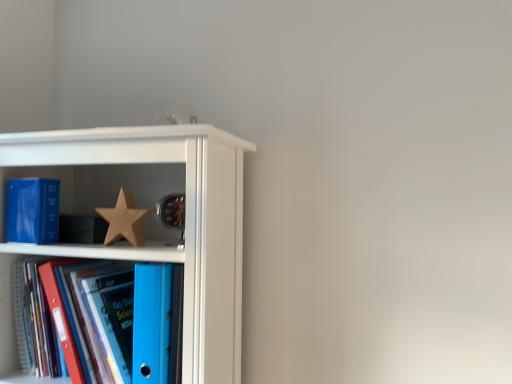
Question: Is white glossy bookshelf at upper left closer to camera compared to matte blue paperback book at left?

Choices:
 (A) yes
 (B) no

Answer: (A)

Question: From a real-world perspective, is white glossy bookshelf at upper left on matte blue paperback book at left?

Choices:
 (A) no
 (B) yes

Answer: (A)

Question: Is white glossy bookshelf at upper left far from matte blue paperback book at left?

Choices:
 (A) yes
 (B) no

Answer: (B)

Question: From the image's perspective, would you say white glossy bookshelf at upper left is shown under matte blue paperback book at left?

Choices:
 (A) yes
 (B) no

Answer: (A)

Question: From a real-world perspective, is white glossy bookshelf at upper left beneath matte blue paperback book at left?

Choices:
 (A) yes
 (B) no

Answer: (A)

Question: Does white glossy bookshelf at upper left have a smaller size compared to matte blue paperback book at left?

Choices:
 (A) no
 (B) yes

Answer: (A)

Question: Is white glossy bookshelf at upper left not inside blue plastic folder at lower left?

Choices:
 (A) no
 (B) yes

Answer: (B)

Question: Can you confirm if white glossy bookshelf at upper left is wider than blue plastic folder at lower left?

Choices:
 (A) yes
 (B) no

Answer: (A)

Question: Is white glossy bookshelf at upper left positioned with its back to blue plastic folder at lower left?

Choices:
 (A) yes
 (B) no

Answer: (A)

Question: Is white glossy bookshelf at upper left in contact with blue plastic folder at lower left?

Choices:
 (A) no
 (B) yes

Answer: (A)

Question: From the image's perspective, would you say white glossy bookshelf at upper left is shown under blue plastic folder at lower left?

Choices:
 (A) yes
 (B) no

Answer: (B)

Question: Considering the relative positions of white glossy bookshelf at upper left and blue plastic folder at lower left in the image provided, is white glossy bookshelf at upper left to the right of blue plastic folder at lower left from the viewer's perspective?

Choices:
 (A) no
 (B) yes

Answer: (B)

Question: Considering the relative sizes of blue plastic folder at lower left and wooden star at center in the image provided, is blue plastic folder at lower left bigger than wooden star at center?

Choices:
 (A) no
 (B) yes

Answer: (B)